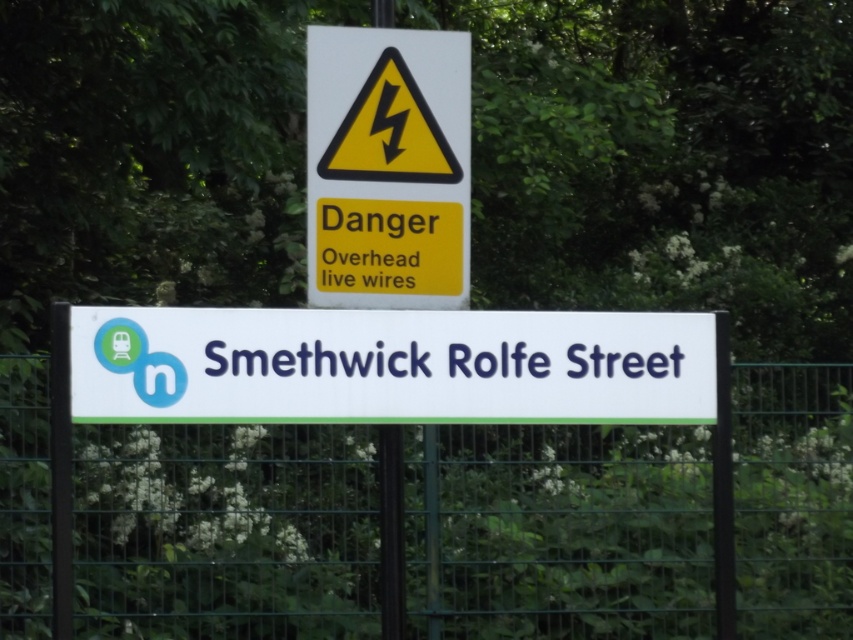
Is green metal fence at lower center to the left of white plastic sign at center from the viewer's perspective?

Incorrect, green metal fence at lower center is not on the left side of white plastic sign at center.

Is point (96, 513) positioned in front of point (368, 372)?

No, it is behind (368, 372).

Locate an element on the screen. green metal fence at lower center is located at coordinates (224, 531).

Identify the location of green metal fence at lower center. The width and height of the screenshot is (853, 640). (224, 531).